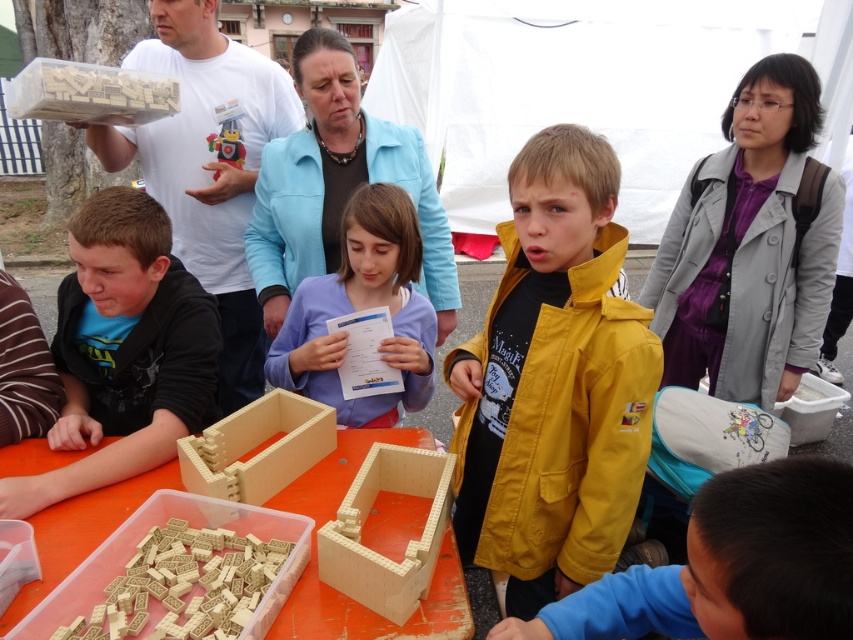
Question: Does yellow matte jacket at center have a lesser width compared to white matte t-shirt at upper left?

Choices:
 (A) yes
 (B) no

Answer: (A)

Question: Which point is closer to the camera?

Choices:
 (A) (207, 566)
 (B) (439, 304)
 (C) (357, 636)
 (D) (254, 106)

Answer: (C)

Question: Does blue matte shirt at lower right have a larger size compared to white matte t-shirt at upper left?

Choices:
 (A) yes
 (B) no

Answer: (B)

Question: Can you confirm if white matte t-shirt at upper left is wider than wooden box at center?

Choices:
 (A) yes
 (B) no

Answer: (A)

Question: Which of the following is the farthest from the observer?

Choices:
 (A) (282, 401)
 (B) (160, 525)
 (C) (453, 637)

Answer: (A)

Question: Which object is the farthest from the wooden box at center?

Choices:
 (A) white matte t-shirt at upper left
 (B) wooden blocks at center
 (C) wooden blocks at lower left

Answer: (A)